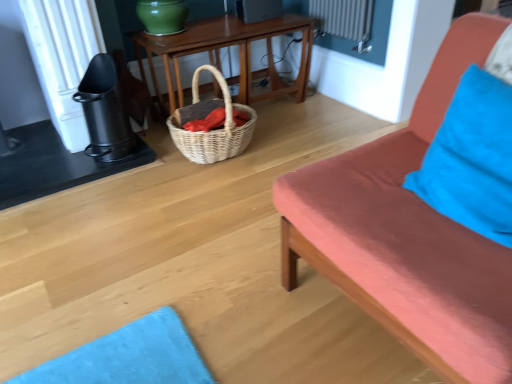
Question: Can blue fabric pillow at right be found inside woven natural picnic basket at center?

Choices:
 (A) no
 (B) yes

Answer: (A)

Question: Is woven natural picnic basket at center at the left side of blue fabric pillow at right?

Choices:
 (A) no
 (B) yes

Answer: (B)

Question: Could you tell me if woven natural picnic basket at center is facing blue fabric pillow at right?

Choices:
 (A) yes
 (B) no

Answer: (A)

Question: From the image's perspective, is woven natural picnic basket at center under blue fabric pillow at right?

Choices:
 (A) no
 (B) yes

Answer: (A)

Question: Is woven natural picnic basket at center further to camera compared to blue fabric pillow at right?

Choices:
 (A) yes
 (B) no

Answer: (A)

Question: Is woven natural picnic basket at center turned away from blue fabric pillow at right?

Choices:
 (A) no
 (B) yes

Answer: (A)

Question: Does woven wicker basket at center turn towards blue fabric pillow at right?

Choices:
 (A) no
 (B) yes

Answer: (A)

Question: Is woven wicker basket at center next to blue fabric pillow at right?

Choices:
 (A) no
 (B) yes

Answer: (A)

Question: Can you confirm if woven wicker basket at center is positioned to the right of blue fabric pillow at right?

Choices:
 (A) yes
 (B) no

Answer: (B)

Question: Is woven wicker basket at center in front of blue fabric pillow at right?

Choices:
 (A) yes
 (B) no

Answer: (B)

Question: Is woven wicker basket at center wider than blue fabric pillow at right?

Choices:
 (A) yes
 (B) no

Answer: (B)

Question: From a real-world perspective, is woven wicker basket at center under blue fabric pillow at right?

Choices:
 (A) yes
 (B) no

Answer: (A)

Question: Can you confirm if matte coral studio couch at right is positioned to the right of woven natural picnic basket at center?

Choices:
 (A) no
 (B) yes

Answer: (B)